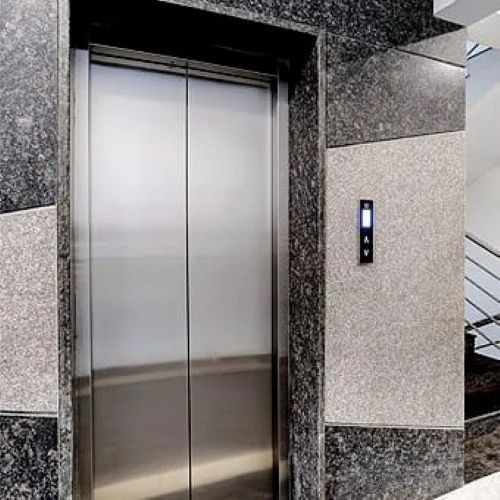
Locate an element on the screen. This screenshot has height=500, width=500. the top left edge of elevator door is located at coordinates (86, 46).